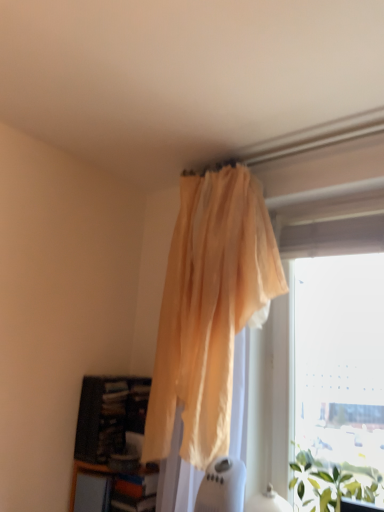
Question: From the image's perspective, relative to dark wood bookcase at lower left, is green leafy plant at lower right above or below?

Choices:
 (A) below
 (B) above

Answer: (A)

Question: Is point [x=354, y=473] closer or farther from the camera than point [x=109, y=458]?

Choices:
 (A) closer
 (B) farther

Answer: (A)

Question: Estimate the real-world distances between objects in this image. Which object is farther from the wooden/textured shelf at lower left?

Choices:
 (A) dark wood bookcase at lower left
 (B) green leafy plant at lower right
 (C) translucent yellow curtain at upper center
 (D) transparent plastic window at upper right

Answer: (D)

Question: Based on their relative distances, which object is nearer to the green leafy plant at lower right?

Choices:
 (A) translucent yellow curtain at upper center
 (B) dark wood bookcase at lower left
 (C) transparent plastic window at upper right
 (D) wooden/textured shelf at lower left

Answer: (C)